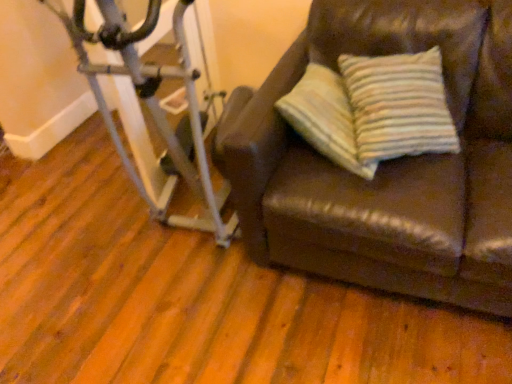
What is the approximate width of brown leather couch at right?

It is 38.96 inches.

This screenshot has width=512, height=384. What do you see at coordinates (387, 162) in the screenshot? I see `brown leather couch at right` at bounding box center [387, 162].

Measure the distance between brown leather couch at right and camera.

brown leather couch at right is 3.89 feet from camera.

At what (x,y) coordinates should I click in order to perform the action: click on brown leather couch at right. Please return your answer as a coordinate pair (x, y). Looking at the image, I should click on click(387, 162).

In order to click on silver metallic stationary bicycle at left in this screenshot , I will do `click(152, 103)`.

This screenshot has width=512, height=384. What do you see at coordinates (152, 103) in the screenshot?
I see `silver metallic stationary bicycle at left` at bounding box center [152, 103].

This screenshot has height=384, width=512. In order to click on brown leather couch at right in this screenshot , I will do `click(387, 162)`.

Based on their positions, is brown leather couch at right located to the left or right of silver metallic stationary bicycle at left?

brown leather couch at right is positioned on silver metallic stationary bicycle at left's right side.

Is brown leather couch at right positioned in front of silver metallic stationary bicycle at left?

Yes, the depth of brown leather couch at right is less than that of silver metallic stationary bicycle at left.

Which is behind, point (365, 44) or point (92, 73)?

Positioned behind is point (365, 44).

From the image's perspective, between brown leather couch at right and silver metallic stationary bicycle at left, who is located below?

From the image's view, brown leather couch at right is below.

From a real-world perspective, is brown leather couch at right on silver metallic stationary bicycle at left?

No, from a real-world perspective, brown leather couch at right is not over silver metallic stationary bicycle at left

Does brown leather couch at right have a lesser width compared to silver metallic stationary bicycle at left?

Yes, brown leather couch at right is thinner than silver metallic stationary bicycle at left.

Does brown leather couch at right have a lesser height compared to silver metallic stationary bicycle at left?

Yes.

Considering the sizes of objects brown leather couch at right and silver metallic stationary bicycle at left in the image provided, who is smaller, brown leather couch at right or silver metallic stationary bicycle at left?

With smaller size is silver metallic stationary bicycle at left.

Is brown leather couch at right not inside silver metallic stationary bicycle at left?

Absolutely, brown leather couch at right is external to silver metallic stationary bicycle at left.

Are brown leather couch at right and silver metallic stationary bicycle at left located far from each other?

Actually, brown leather couch at right and silver metallic stationary bicycle at left are a little close together.

Could you tell me if brown leather couch at right is turned towards silver metallic stationary bicycle at left?

No, brown leather couch at right is not aimed at silver metallic stationary bicycle at left.

How different are the orientations of brown leather couch at right and silver metallic stationary bicycle at left in degrees?

2.61 degrees separate the facing orientations of brown leather couch at right and silver metallic stationary bicycle at left.

How much distance is there between brown leather couch at right and silver metallic stationary bicycle at left?

20.26 inches.

The height and width of the screenshot is (384, 512). In order to click on studio couch on the right of silver metallic stationary bicycle at left in this screenshot , I will do `click(387, 162)`.

Considering the positions of objects silver metallic stationary bicycle at left and brown leather couch at right in the image provided, who is more to the right, silver metallic stationary bicycle at left or brown leather couch at right?

brown leather couch at right.

Consider the image. Which is behind, silver metallic stationary bicycle at left or brown leather couch at right?

silver metallic stationary bicycle at left is further away from the camera.

Which is in front, point (214, 220) or point (479, 78)?

Point (479, 78)

From the image's perspective, is silver metallic stationary bicycle at left located above brown leather couch at right?

Yes.

From a real-world perspective, is silver metallic stationary bicycle at left positioned over brown leather couch at right based on gravity?

Correct, in the physical world, silver metallic stationary bicycle at left is higher than brown leather couch at right.

Which object is thinner, silver metallic stationary bicycle at left or brown leather couch at right?

Thinner between the two is brown leather couch at right.

From their relative heights in the image, would you say silver metallic stationary bicycle at left is taller or shorter than brown leather couch at right?

In the image, silver metallic stationary bicycle at left appears to be taller than brown leather couch at right.

Is silver metallic stationary bicycle at left bigger or smaller than brown leather couch at right?

In the image, silver metallic stationary bicycle at left appears to be smaller than brown leather couch at right.

Choose the correct answer: Is silver metallic stationary bicycle at left inside brown leather couch at right or outside it?

silver metallic stationary bicycle at left is outside brown leather couch at right.

Is silver metallic stationary bicycle at left next to brown leather couch at right?

silver metallic stationary bicycle at left and brown leather couch at right are not in contact.

Is silver metallic stationary bicycle at left aimed at brown leather couch at right?

No, silver metallic stationary bicycle at left is not aimed at brown leather couch at right.

Identify the location of studio couch on the right of silver metallic stationary bicycle at left. This screenshot has height=384, width=512. (387, 162).

At what (x,y) coordinates should I click in order to perform the action: click on stationary bicycle that appears behind the brown leather couch at right. Please return your answer as a coordinate pair (x, y). This screenshot has width=512, height=384. Looking at the image, I should click on (152, 103).

Find the location of a particular element. The image size is (512, 384). studio couch below the silver metallic stationary bicycle at left (from a real-world perspective) is located at coordinates (387, 162).